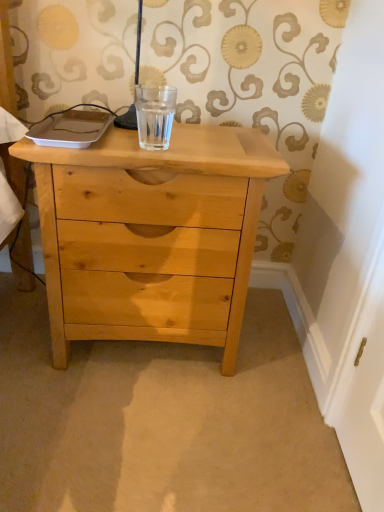
The image size is (384, 512). In order to click on clear glass water at center in this screenshot , I will do `click(155, 115)`.

This screenshot has width=384, height=512. What do you see at coordinates (155, 115) in the screenshot? I see `clear glass water at center` at bounding box center [155, 115].

At what (x,y) coordinates should I click in order to perform the action: click on natural wood chest of drawers at center. Please return your answer as a coordinate pair (x, y). The image size is (384, 512). Looking at the image, I should click on (150, 221).

What do you see at coordinates (150, 221) in the screenshot? I see `natural wood chest of drawers at center` at bounding box center [150, 221].

Locate an element on the screen. clear glass water at center is located at coordinates (155, 115).

Consider the image. Is natural wood chest of drawers at center at the right side of clear glass water at center?

No, natural wood chest of drawers at center is not to the right of clear glass water at center.

Between natural wood chest of drawers at center and clear glass water at center, which one is positioned in front?

natural wood chest of drawers at center is in front.

Considering the positions of point (238, 301) and point (143, 101), is point (238, 301) closer or farther from the camera than point (143, 101)?

Point (238, 301).

From the image's perspective, is natural wood chest of drawers at center below clear glass water at center?

Correct, natural wood chest of drawers at center appears lower than clear glass water at center in the image.

From a real-world perspective, is natural wood chest of drawers at center positioned over clear glass water at center based on gravity?

Incorrect, from a real-world perspective, natural wood chest of drawers at center is lower than clear glass water at center.

Does natural wood chest of drawers at center have a lesser width compared to clear glass water at center?

No.

Considering the sizes of objects natural wood chest of drawers at center and clear glass water at center in the image provided, who is shorter, natural wood chest of drawers at center or clear glass water at center?

clear glass water at center is shorter.

In terms of size, does natural wood chest of drawers at center appear bigger or smaller than clear glass water at center?

Clearly, natural wood chest of drawers at center is larger in size than clear glass water at center.

Is clear glass water at center inside natural wood chest of drawers at center?

No, clear glass water at center is not inside natural wood chest of drawers at center.

Is natural wood chest of drawers at center not near clear glass water at center?

No, natural wood chest of drawers at center is in close proximity to clear glass water at center.

Is natural wood chest of drawers at center facing towards clear glass water at center?

No, natural wood chest of drawers at center does not turn towards clear glass water at center.

Image resolution: width=384 pixels, height=512 pixels. I want to click on the chest of drawers that is below the clear glass water at center (from the image's perspective), so click(150, 221).

Can you confirm if clear glass water at center is positioned to the right of natural wood chest of drawers at center?

Correct, you'll find clear glass water at center to the right of natural wood chest of drawers at center.

Considering the relative positions of clear glass water at center and natural wood chest of drawers at center in the image provided, is clear glass water at center behind natural wood chest of drawers at center?

Yes, clear glass water at center is behind natural wood chest of drawers at center.

Considering the positions of points (153, 111) and (65, 364), is point (153, 111) closer to camera compared to point (65, 364)?

No, it is behind (65, 364).

From the image's perspective, is clear glass water at center located above or below natural wood chest of drawers at center?

Based on their image positions, clear glass water at center is located above natural wood chest of drawers at center.

From a real-world perspective, between clear glass water at center and natural wood chest of drawers at center, who is vertically lower?

natural wood chest of drawers at center.

Which of these two, clear glass water at center or natural wood chest of drawers at center, is wider?

Wider between the two is natural wood chest of drawers at center.

Which of these two, clear glass water at center or natural wood chest of drawers at center, stands shorter?

clear glass water at center is shorter.

Can you confirm if clear glass water at center is bigger than natural wood chest of drawers at center?

Actually, clear glass water at center might be smaller than natural wood chest of drawers at center.

From the picture: Would you say clear glass water at center is inside or outside natural wood chest of drawers at center?

clear glass water at center is outside natural wood chest of drawers at center.

Is clear glass water at center beside natural wood chest of drawers at center?

clear glass water at center and natural wood chest of drawers at center are clearly separated.

Is natural wood chest of drawers at center at the back of clear glass water at center?

That's not correct — clear glass water at center is not looking away from natural wood chest of drawers at center.

Locate an element on the screen. beverage behind the natural wood chest of drawers at center is located at coordinates (155, 115).

The image size is (384, 512). What are the coordinates of `beverage above the natural wood chest of drawers at center (from the image's perspective)` in the screenshot? It's located at (155, 115).

Where is `chest of drawers located on the left of clear glass water at center`? chest of drawers located on the left of clear glass water at center is located at coordinates (150, 221).